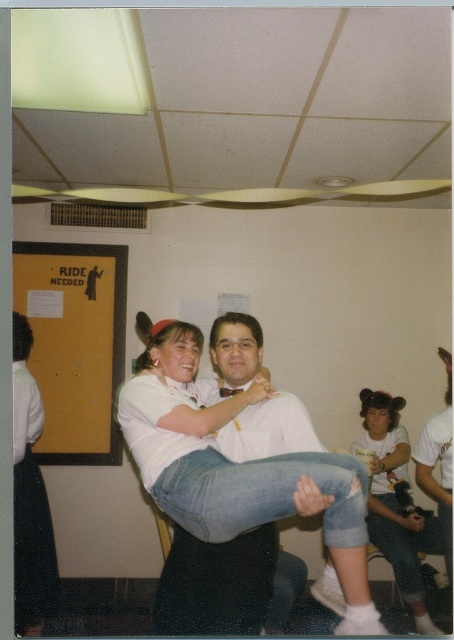
Is denim shorts at lower right taller than white matte shirt at upper right?

Correct, denim shorts at lower right is much taller as white matte shirt at upper right.

Image resolution: width=454 pixels, height=640 pixels. Describe the element at coordinates (395, 500) in the screenshot. I see `denim shorts at lower right` at that location.

What do you see at coordinates (395, 500) in the screenshot? I see `denim shorts at lower right` at bounding box center [395, 500].

In order to click on denim shorts at lower right in this screenshot , I will do `click(395, 500)`.

Is matte white arm at lower right below matte black arm at lower center?

Actually, matte white arm at lower right is above matte black arm at lower center.

The height and width of the screenshot is (640, 454). Describe the element at coordinates (390, 458) in the screenshot. I see `matte white arm at lower right` at that location.

The image size is (454, 640). In order to click on matte white arm at lower right in this screenshot , I will do pos(390,458).

Identify the location of white matte shirt at upper right. (434, 456).

Who is taller, white matte shirt at upper right or matte white arm at lower right?

With more height is white matte shirt at upper right.

Is point (432, 417) positioned after point (404, 432)?

No, it is not.

Identify the location of white matte shirt at upper right. (434, 456).